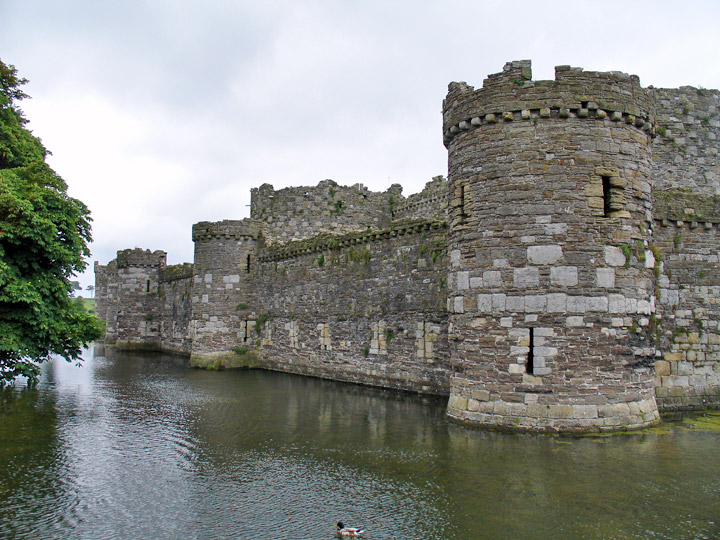
The image size is (720, 540). Find the location of `windows`. windows is located at coordinates (613, 200), (454, 207), (240, 267), (230, 327), (148, 279).